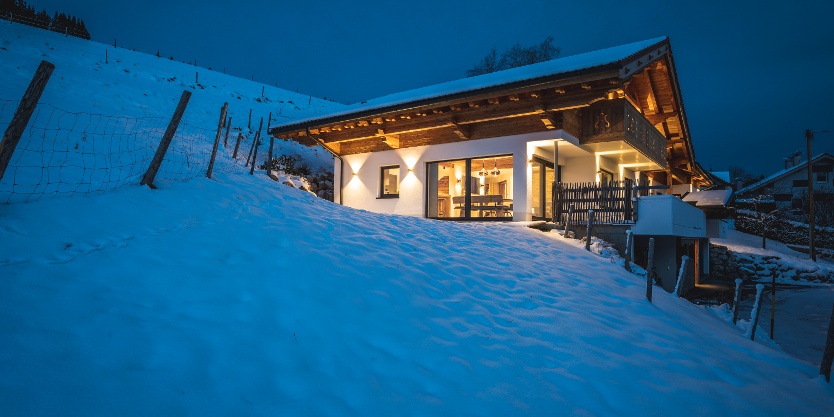
This screenshot has height=417, width=834. Find the location of `lights`. lights is located at coordinates (354, 169), (409, 159).